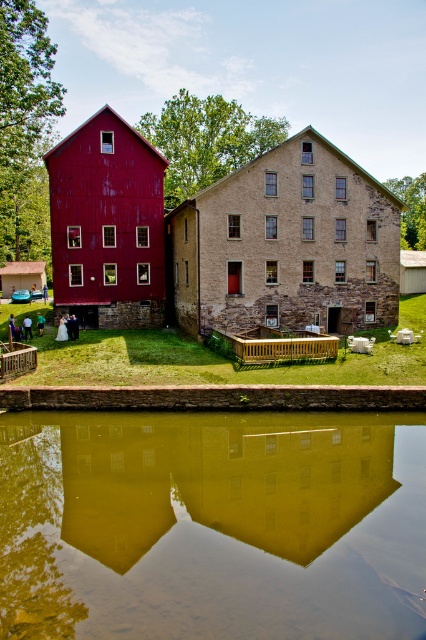
You are an architect designing a new pathway between the brown stone barn at center and the matte red barn at left. Considering their sizes, which barn should the pathway be wider next to?

The pathway should be wider next to the brown stone barn at center because its width is larger than the matte red barn at left, allowing for a more proportionate design.

Based on the photo, you are standing on the dock and want to take a photo of the matte red barn at left and the green reflective water at center. Which object should you focus on first if you want to capture both in a single frame without moving the camera?

You should focus on the matte red barn at left first because the green reflective water at center is positioned under it, meaning they are aligned vertically. By focusing on the barn, you can ensure both objects are within the camera frame simultaneously.

You are an architect assessing the two barns in the scene. Which barn has a lower height when comparing the brown stone barn at center and the matte red barn at left?

The brown stone barn at center is shorter than the matte red barn at left, so the brown stone barn at center has a lower height.